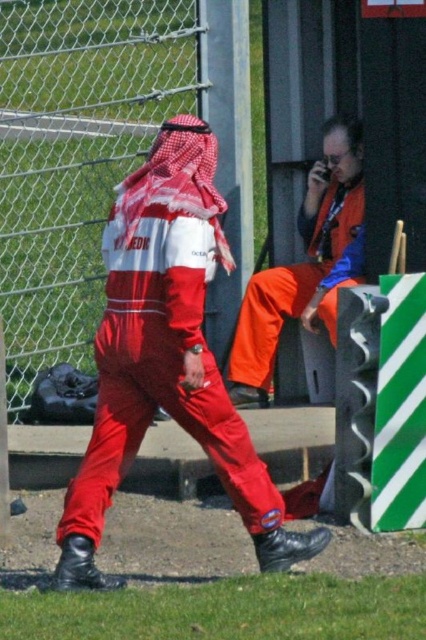
Between metallic chain-link fence at upper left and matte red jumpsuit at center, which one appears on the left side from the viewer's perspective?

metallic chain-link fence at upper left is more to the left.

The height and width of the screenshot is (640, 426). What do you see at coordinates (75, 156) in the screenshot?
I see `metallic chain-link fence at upper left` at bounding box center [75, 156].

Find the location of `metallic chain-link fence at upper left`. metallic chain-link fence at upper left is located at coordinates (75, 156).

Can you confirm if matte red jumpsuit at center is thinner than orange fabric pants at center?

No, matte red jumpsuit at center is not thinner than orange fabric pants at center.

I want to click on matte red jumpsuit at center, so point(166,356).

Between metallic chain-link fence at upper left and orange fabric pants at center, which one has more height?

Standing taller between the two is metallic chain-link fence at upper left.

Between point (66, 228) and point (299, 308), which one is positioned in front?

Point (66, 228) is more forward.

Find the location of a particular element. The height and width of the screenshot is (640, 426). metallic chain-link fence at upper left is located at coordinates (75, 156).